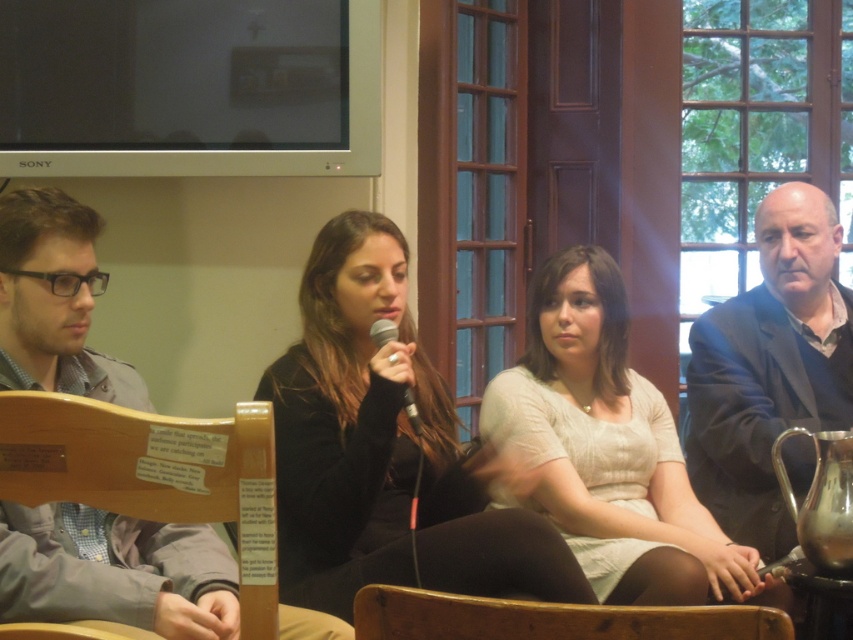
In the scene shown: You are taking a photo of the scene and want to ensure both the plaque on the wooden chair and the person in the gray jacket are in focus. Given that the plaque is at point (61,467) and the person is at point (790,628), which object is closer to your camera?

Point (61,467) is further to the camera than point (790,628). Therefore, the plaque on the wooden chair at point (61,467) is closer to the camera compared to the person in the gray jacket at point (790,628). To ensure both are in focus, adjust the camera focus to accommodate the distance between these two points.

You are organizing a small event in the room and need to determine seating arrangements. Given that the wooden chair at lower left and the wooden chair at lower center are available, which chair would allow for more guests to be seated around the table if space is limited?

The wooden chair at lower left occupies less space than the wooden chair at lower center, so it would allow for more guests to be seated around the table in a space limited area.